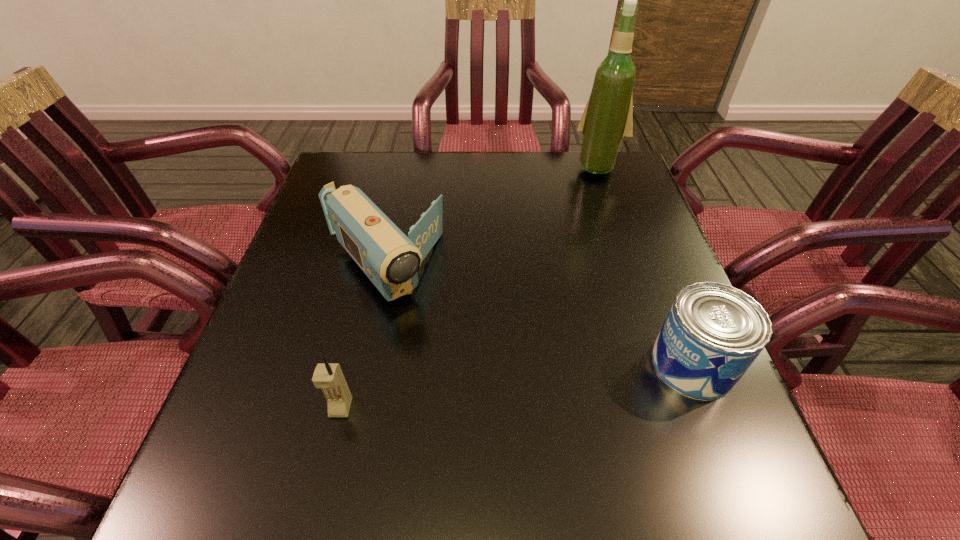
Locate an element on the screen. The image size is (960, 540). free space between the second farthest object and the can is located at coordinates (538, 317).

Where is `empty location between the third nearest object and the can`? The height and width of the screenshot is (540, 960). empty location between the third nearest object and the can is located at coordinates (538, 317).

Where is `vacant region between the camcorder and the wine bottle`? vacant region between the camcorder and the wine bottle is located at coordinates (491, 218).

You are a GUI agent. You are given a task and a screenshot of the screen. Output one action in this format:
    pyautogui.click(x=<x>, y=<y>)
    Task: Click on the free space between the third nearest object and the farthest object
    The height and width of the screenshot is (540, 960).
    Given the screenshot: What is the action you would take?
    pyautogui.click(x=491, y=218)

Locate an element on the screen. empty space that is in between the camcorder and the shortest object is located at coordinates (538, 317).

Image resolution: width=960 pixels, height=540 pixels. Find the location of `free space between the shortest object and the camcorder`. free space between the shortest object and the camcorder is located at coordinates (538, 317).

This screenshot has width=960, height=540. In order to click on vacant space that's between the farthest object and the camcorder in this screenshot , I will do `click(491, 218)`.

I want to click on free space between the second farthest object and the cellular telephone, so [362, 339].

Where is `blank region between the second farthest object and the tallest object`? The width and height of the screenshot is (960, 540). blank region between the second farthest object and the tallest object is located at coordinates (491, 218).

I want to click on free space between the cellular telephone and the shortest object, so click(516, 386).